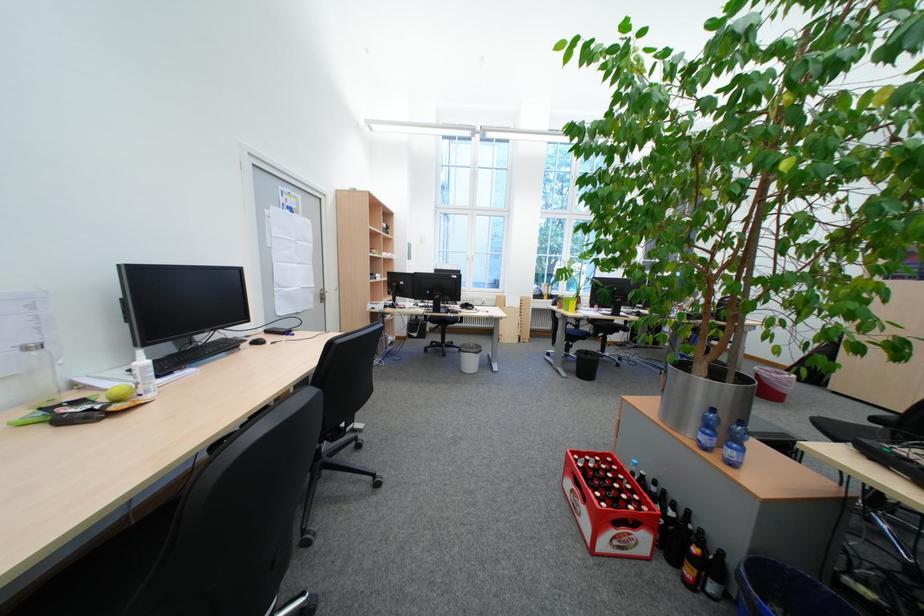
The location [142,377] corresponds to which object?

It refers to a white spray bottle.